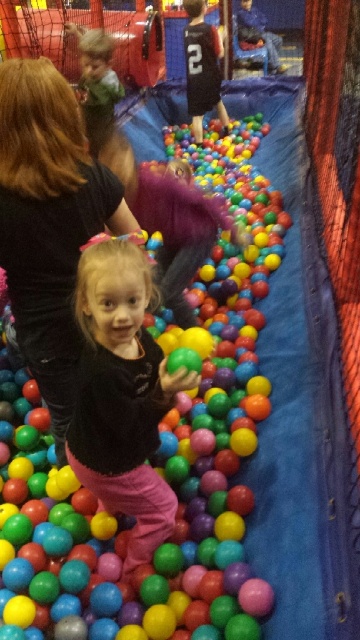
Question: Is matte plastic ball at center above matte green shirt at upper left?

Choices:
 (A) yes
 (B) no

Answer: (B)

Question: Which of the following is the farthest from the observer?

Choices:
 (A) (47, 122)
 (B) (10, 496)
 (C) (95, 106)
 (D) (174, 392)

Answer: (C)

Question: Among these points, which one is nearest to the camera?

Choices:
 (A) 70,26
 (B) 138,312
 (C) 248,180
 (D) 10,280

Answer: (B)

Question: Does matte black shirt at center have a smaller size compared to matte green shirt at upper left?

Choices:
 (A) no
 (B) yes

Answer: (B)

Question: Is black fabric at upper left thinner than matte green shirt at upper left?

Choices:
 (A) no
 (B) yes

Answer: (A)

Question: Which of the following is the farthest from the observer?

Choices:
 (A) black fabric at upper left
 (B) matte green shirt at upper left
 (C) matte plastic ball at center
 (D) matte black shirt at center

Answer: (B)